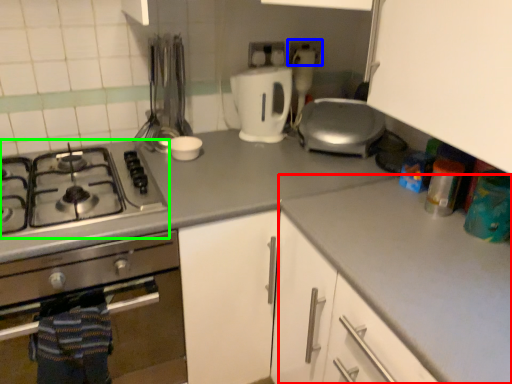
Question: Which is nearer to the counter top (highlighted by a red box)? electric outlet (highlighted by a blue box) or gas stove (highlighted by a green box).

Choices:
 (A) electric outlet
 (B) gas stove

Answer: (B)